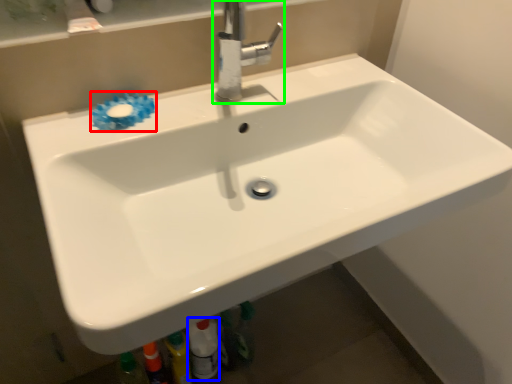
Question: Estimate the real-world distances between objects in this image. Which object is closer to flower (highlighted by a red box), toiletry (highlighted by a blue box) or tap (highlighted by a green box)?

Choices:
 (A) toiletry
 (B) tap

Answer: (B)